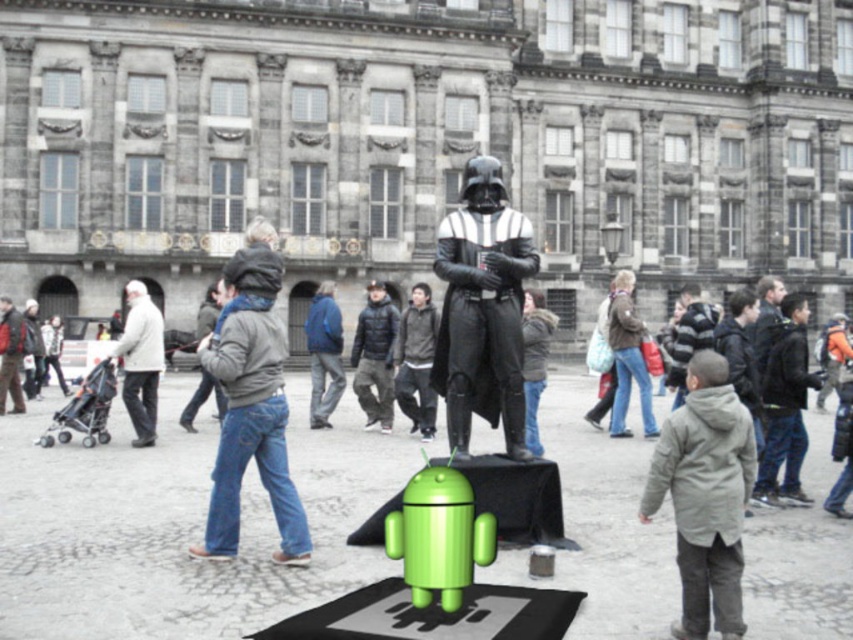
Is black leather suit at center shorter than denim jacket at center?

No, black leather suit at center is not shorter than denim jacket at center.

Which is in front, point (450, 244) or point (263, 465)?

Point (263, 465) is in front.

In order to click on black leather suit at center in this screenshot , I will do (x=482, y=308).

Is point (518, 346) in front of point (10, 346)?

Yes, it is in front of point (10, 346).

Is black leather suit at center to the left of dark gray jacket at center from the viewer's perspective?

No, black leather suit at center is not to the left of dark gray jacket at center.

This screenshot has height=640, width=853. I want to click on black leather suit at center, so click(x=482, y=308).

Where is `black leather suit at center`? Image resolution: width=853 pixels, height=640 pixels. black leather suit at center is located at coordinates (482, 308).

Between denim jacket at center and white woolen coat at left, which one is positioned higher?

Positioned higher is white woolen coat at left.

Is denim jacket at center taller than white woolen coat at left?

Correct, denim jacket at center is much taller as white woolen coat at left.

I want to click on denim jacket at center, so click(250, 426).